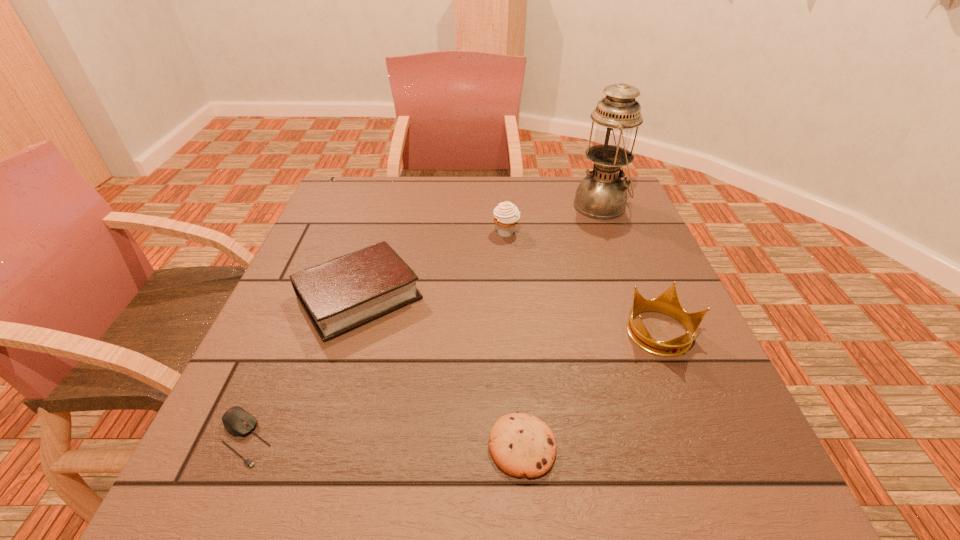
Identify the location of crown present at the right edge. (668, 302).

Identify the location of object situated at the near left corner. (238, 422).

This screenshot has height=540, width=960. I want to click on object that is at the far right corner, so click(x=602, y=195).

The image size is (960, 540). I want to click on vacant space at the far edge of the desktop, so point(548,186).

The image size is (960, 540). I want to click on vacant space at the left edge of the desktop, so click(x=368, y=228).

In the image, there is a desktop. Find the location of `vacant space at the right edge`. vacant space at the right edge is located at coordinates click(635, 254).

In the image, there is a desktop. Identify the location of vacant region at the far left corner. (372, 188).

In the image, there is a desktop. At what (x,y) coordinates should I click in order to perform the action: click on vacant space at the far right corner. Please return your answer as a coordinate pair (x, y). Looking at the image, I should click on (631, 213).

Locate an element on the screen. vacant area between the mouse and the Bible is located at coordinates (301, 367).

Identify the location of vacant area between the farthest object and the crown. The height and width of the screenshot is (540, 960). (631, 269).